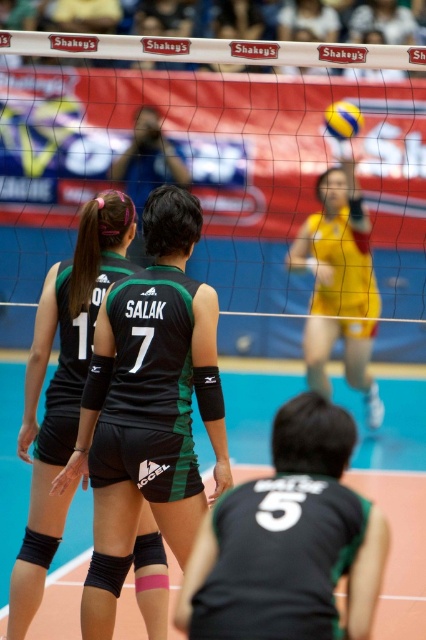
Is black matte uniform at center smaller than yellow/yellowish-green jersey at center?

Correct, black matte uniform at center occupies less space than yellow/yellowish-green jersey at center.

Can you confirm if black matte uniform at center is taller than yellow/yellowish-green jersey at center?

In fact, black matte uniform at center may be shorter than yellow/yellowish-green jersey at center.

Is point (158, 538) behind point (362, 330)?

No, (158, 538) is closer to viewer.

You are a GUI agent. You are given a task and a screenshot of the screen. Output one action in this format:
    pyautogui.click(x=<x>, y=<y>)
    Task: Click on the black matte uniform at center
    The image size is (426, 640).
    Given the screenshot: What is the action you would take?
    pyautogui.click(x=63, y=385)

Is the position of transparent nylon net at center more distant than that of yellow/yellowish-green jersey at center?

No, transparent nylon net at center is in front of yellow/yellowish-green jersey at center.

Is transparent nylon net at center thinner than yellow/yellowish-green jersey at center?

No.

Identify the location of transparent nylon net at center. (222, 177).

Locate an element on the screen. The height and width of the screenshot is (640, 426). transparent nylon net at center is located at coordinates (222, 177).

Does black mesh volleyball net at center appear over yellow/yellowish-green jersey at center?

No, black mesh volleyball net at center is not above yellow/yellowish-green jersey at center.

Can you confirm if black mesh volleyball net at center is shorter than yellow/yellowish-green jersey at center?

Yes, black mesh volleyball net at center is shorter than yellow/yellowish-green jersey at center.

Is point (23, 484) behind point (334, 276)?

No, (23, 484) is in front of (334, 276).

Where is `black mesh volleyball net at center`? The width and height of the screenshot is (426, 640). black mesh volleyball net at center is located at coordinates (394, 480).